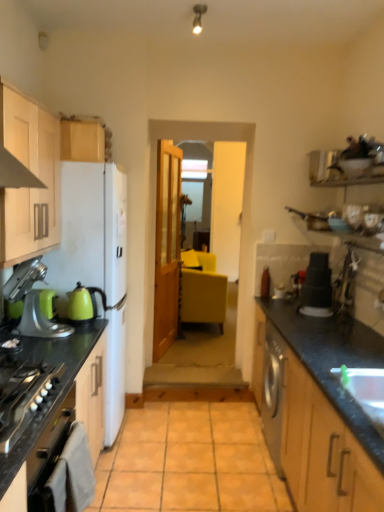
Locate an element on the screen. This screenshot has width=384, height=512. vacant space situated above black matte oven at lower left (from a real-world perspective) is located at coordinates (73, 438).